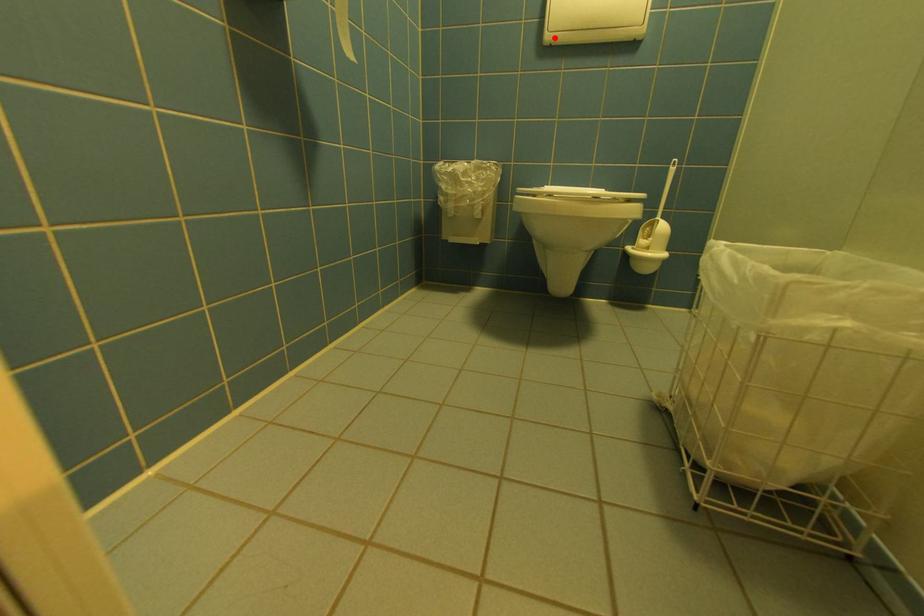
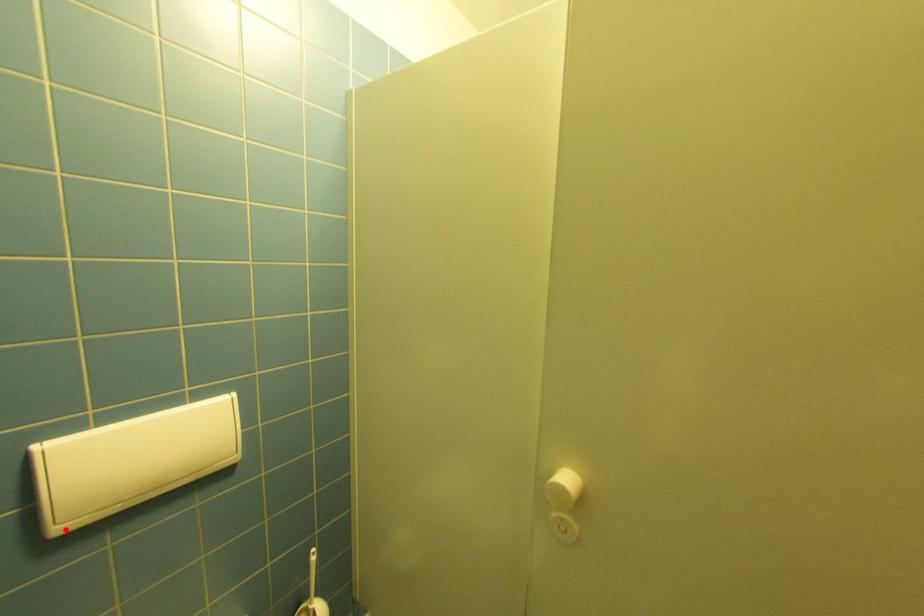
Looking at this image, I am providing you with two images of the same scene from different viewpoints. A red point is marked on the first image and another point is marked on the second image. Are the points marked in image1 and image2 representing the same 3D position?

Yes